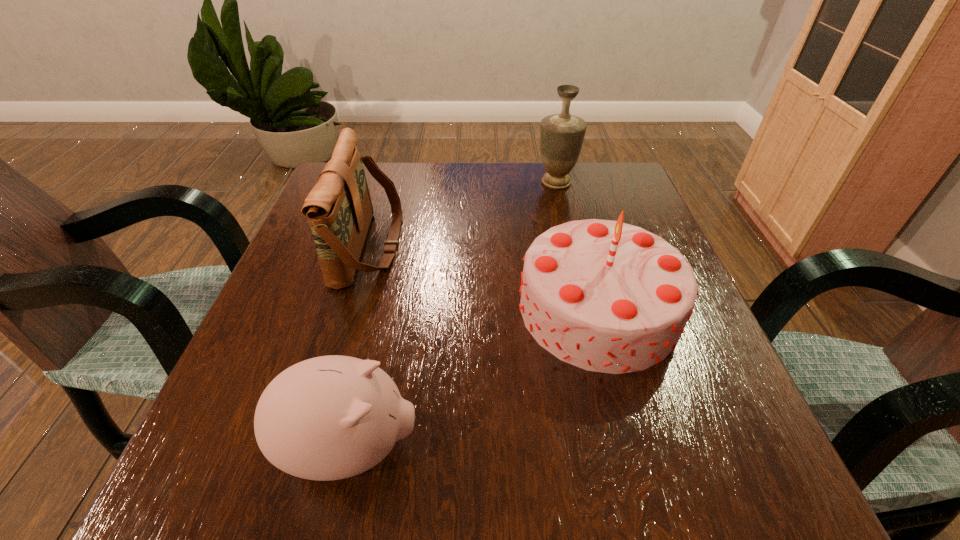
The height and width of the screenshot is (540, 960). Find the location of `vacant region between the shoulder bag and the birthday cake`. vacant region between the shoulder bag and the birthday cake is located at coordinates (484, 277).

You are a GUI agent. You are given a task and a screenshot of the screen. Output one action in this format:
    pyautogui.click(x=<x>, y=<y>)
    Task: Click on the free space that is in between the shortest object and the shoulder bag
    Image resolution: width=960 pixels, height=540 pixels.
    Given the screenshot: What is the action you would take?
    pyautogui.click(x=360, y=346)

What are the coordinates of `the second closest object to the nearest object` in the screenshot? It's located at (339, 209).

Select which object is the closest to the shortest object. Please provide its 2D coordinates. Your answer should be formatted as a tuple, i.e. [(x, y)], where the tuple contains the x and y coordinates of a point satisfying the conditions above.

[(605, 296)]

The image size is (960, 540). Identify the location of vacant space that satisfies the following two spatial constraints: 1. on the back side of the birthday cake; 2. on the front-facing side of the shoulder bag. (582, 245).

Locate an element on the screen. vacant space that satisfies the following two spatial constraints: 1. on the front-facing side of the birthday cake; 2. on the left side of the shoulder bag is located at coordinates (351, 308).

At what (x,y) coordinates should I click in order to perform the action: click on vacant space that satisfies the following two spatial constraints: 1. on the front side of the urn; 2. at the snout of the piggy bank. Please return your answer as a coordinate pair (x, y). Image resolution: width=960 pixels, height=540 pixels. Looking at the image, I should click on (619, 447).